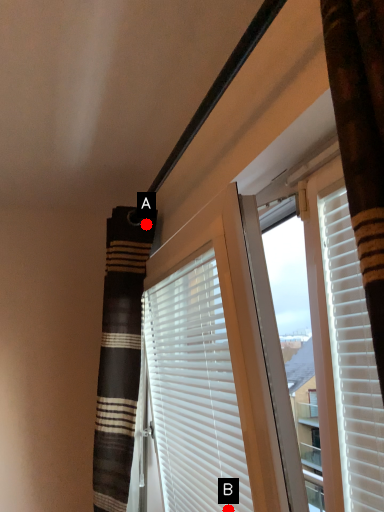
Question: Two points are circled on the image, labeled by A and B beside each circle. Which of the following is the closest to the observer?

Choices:
 (A) A is closer
 (B) B is closer

Answer: (B)